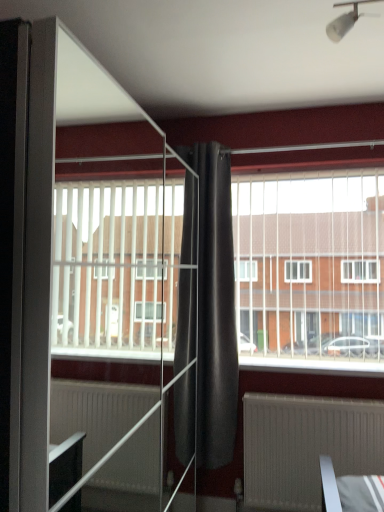
Describe the element at coordinates (310, 266) in the screenshot. The width and height of the screenshot is (384, 512). I see `white plastic blinds at center` at that location.

In order to click on white plastic blinds at center in this screenshot , I will do `click(310, 266)`.

Measure the distance between point (x=358, y=15) and camera.

The distance of point (x=358, y=15) from camera is 1.47 meters.

What is the approximate height of white plastic light fixture at upper center?

The height of white plastic light fixture at upper center is 6.96 inches.

The image size is (384, 512). Describe the element at coordinates (215, 307) in the screenshot. I see `dark matte curtain at center` at that location.

The height and width of the screenshot is (512, 384). What are the coordinates of `transparent glass screen door at center` in the screenshot? It's located at (95, 271).

From a real-world perspective, between matte gray radiator at lower center and white plastic light fixture at upper center, who is vertically lower?

matte gray radiator at lower center is physically lower.

Is matte gray radiator at lower center surrounding white plastic light fixture at upper center?

Actually, white plastic light fixture at upper center is outside matte gray radiator at lower center.

Is matte gray radiator at lower center looking in the opposite direction of white plastic light fixture at upper center?

No, matte gray radiator at lower center is not facing the opposite direction of white plastic light fixture at upper center.

Can you confirm if matte gray radiator at lower center is thinner than white plastic light fixture at upper center?

Correct, the width of matte gray radiator at lower center is less than that of white plastic light fixture at upper center.

Who is smaller, dark matte curtain at center or white plastic blinds at center?

Smaller between the two is dark matte curtain at center.

From a real-world perspective, which is physically below, dark matte curtain at center or white plastic blinds at center?

From a 3D spatial view, dark matte curtain at center is below.

Would you say dark matte curtain at center is to the left or to the right of white plastic blinds at center in the picture?

From the image, it's evident that dark matte curtain at center is to the left of white plastic blinds at center.

Is dark matte curtain at center inside or outside of white plastic blinds at center?

dark matte curtain at center is spatially situated outside white plastic blinds at center.

Looking at this image, does white plastic blinds at center come behind dark matte curtain at center?

Yes, the depth of white plastic blinds at center is greater than that of dark matte curtain at center.

Does white plastic blinds at center have a larger size compared to dark matte curtain at center?

Indeed, white plastic blinds at center has a larger size compared to dark matte curtain at center.

Is white plastic blinds at center inside or outside of dark matte curtain at center?

white plastic blinds at center is located beyond the bounds of dark matte curtain at center.

I want to click on radiator that appears on the right of transparent glass screen door at center, so click(306, 446).

Between transparent glass screen door at center and matte gray radiator at lower center, which one appears on the right side from the viewer's perspective?

matte gray radiator at lower center is more to the right.

Is transparent glass screen door at center inside or outside of matte gray radiator at lower center?

transparent glass screen door at center exists outside the volume of matte gray radiator at lower center.

Are transparent glass screen door at center and matte gray radiator at lower center far apart?

transparent glass screen door at center is near matte gray radiator at lower center, not far away.

From the image's perspective, does transparent glass screen door at center appear higher than white plastic blinds at center?

No.

Who is bigger, transparent glass screen door at center or white plastic blinds at center?

With larger size is transparent glass screen door at center.

What's the angular difference between transparent glass screen door at center and white plastic blinds at center's facing directions?

transparent glass screen door at center and white plastic blinds at center are facing 90.7 degrees away from each other.

Is transparent glass screen door at center not within white plastic blinds at center?

That's correct, transparent glass screen door at center is outside of white plastic blinds at center.

From the image's perspective, which one is positioned lower, white plastic blinds at center or matte gray radiator at lower center?

From the image's view, matte gray radiator at lower center is below.

Which is correct: white plastic blinds at center is inside matte gray radiator at lower center, or outside of it?

white plastic blinds at center lies outside matte gray radiator at lower center.

In terms of width, does white plastic blinds at center look wider or thinner when compared to matte gray radiator at lower center?

Clearly, white plastic blinds at center has more width compared to matte gray radiator at lower center.

Locate an element on the screen. Image resolution: width=384 pixels, height=512 pixels. radiator below the white plastic blinds at center (from a real-world perspective) is located at coordinates (306, 446).

How many degrees apart are the facing directions of white plastic light fixture at upper center and white plastic blinds at center?

The angle between the facing direction of white plastic light fixture at upper center and the facing direction of white plastic blinds at center is 0.0666 degrees.

From the image's perspective, which one is positioned lower, white plastic light fixture at upper center or white plastic blinds at center?

white plastic blinds at center appears lower in the image.

Which object is closer to the camera, white plastic light fixture at upper center or white plastic blinds at center?

white plastic light fixture at upper center is closer to the camera.

Is white plastic light fixture at upper center bigger than white plastic blinds at center?

No, white plastic light fixture at upper center is not bigger than white plastic blinds at center.

You are a GUI agent. You are given a task and a screenshot of the screen. Output one action in this format:
    pyautogui.click(x=<x>, y=<y>)
    Task: Click on the light fixture on the left side of matte gray radiator at lower center
    The image size is (384, 512).
    Given the screenshot: What is the action you would take?
    pyautogui.click(x=346, y=19)

At what (x,y) coordinates should I click in order to perform the action: click on window screen behind the dark matte curtain at center. Please return your answer as a coordinate pair (x, y). The height and width of the screenshot is (512, 384). Looking at the image, I should click on (310, 266).

When comparing their distances from transparent glass screen door at center, does white plastic light fixture at upper center or dark matte curtain at center seem further?

white plastic light fixture at upper center is positioned further to the anchor transparent glass screen door at center.

Looking at the image, which one is located further to white plastic blinds at center, white plastic light fixture at upper center or transparent glass screen door at center?

white plastic light fixture at upper center is further to white plastic blinds at center.

Based on their spatial positions, is white plastic light fixture at upper center or transparent glass screen door at center further from dark matte curtain at center?

white plastic light fixture at upper center is positioned further to the anchor dark matte curtain at center.

Based on their spatial positions, is dark matte curtain at center or white plastic blinds at center further from white plastic light fixture at upper center?

dark matte curtain at center is further to white plastic light fixture at upper center.

From the image, which object appears to be farther from transparent glass screen door at center, white plastic blinds at center or dark matte curtain at center?

Based on the image, white plastic blinds at center appears to be further to transparent glass screen door at center.

When comparing their distances from white plastic light fixture at upper center, does matte gray radiator at lower center or dark matte curtain at center seem closer?

dark matte curtain at center lies closer to white plastic light fixture at upper center than the other object.

Based on their spatial positions, is white plastic blinds at center or white plastic light fixture at upper center further from transparent glass screen door at center?

white plastic light fixture at upper center lies further to transparent glass screen door at center than the other object.

From the image, which object appears to be farther from white plastic light fixture at upper center, white plastic blinds at center or dark matte curtain at center?

Among the two, dark matte curtain at center is located further to white plastic light fixture at upper center.

The width and height of the screenshot is (384, 512). Find the location of `radiator between transparent glass screen door at center and dark matte curtain at center from front to back`. radiator between transparent glass screen door at center and dark matte curtain at center from front to back is located at coordinates (306, 446).

Identify the location of screen door between white plastic light fixture at upper center and matte gray radiator at lower center from top to bottom. This screenshot has width=384, height=512. (95, 271).

Locate an element on the screen. This screenshot has width=384, height=512. window screen between white plastic light fixture at upper center and dark matte curtain at center vertically is located at coordinates (310, 266).

The height and width of the screenshot is (512, 384). Identify the location of light fixture between transparent glass screen door at center and white plastic blinds at center in the front-back direction. (346, 19).